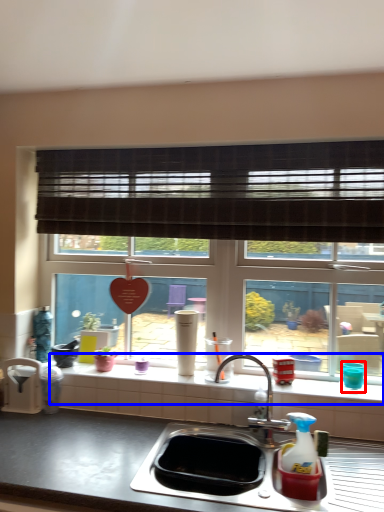
Question: Which of the following is the closest to the observer, appliance (highlighted by a red box) or window sill (highlighted by a blue box)?

Choices:
 (A) appliance
 (B) window sill

Answer: (B)